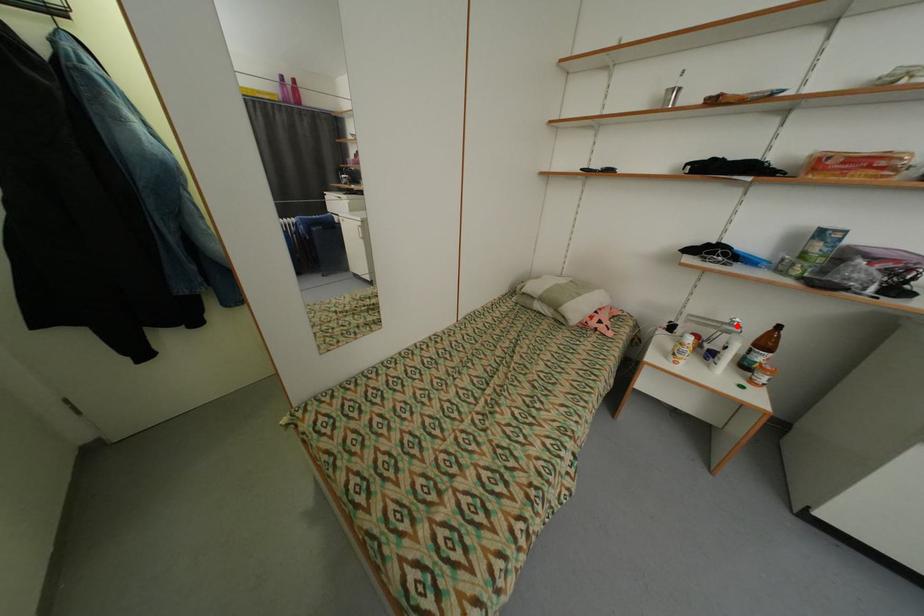
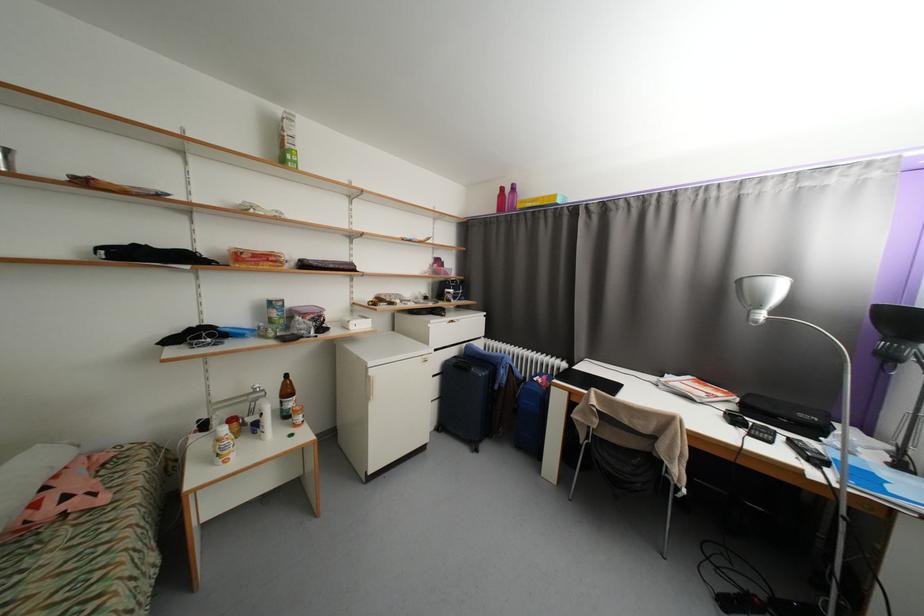
Locate, in the second image, the point that corresponds to the highlighted location in the first image.

(261, 392)